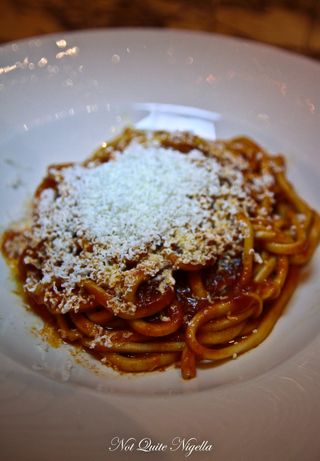
This screenshot has height=461, width=320. In order to click on edge of plate in this screenshot , I will do `click(155, 30)`.